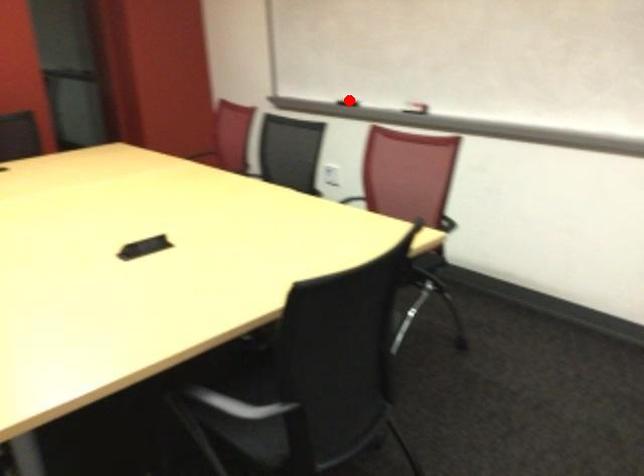
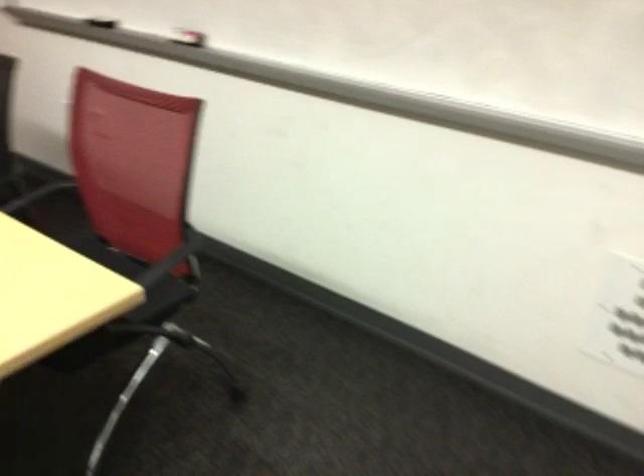
Locate, in the second image, the point that corresponds to the highlighted location in the first image.

(102, 21)